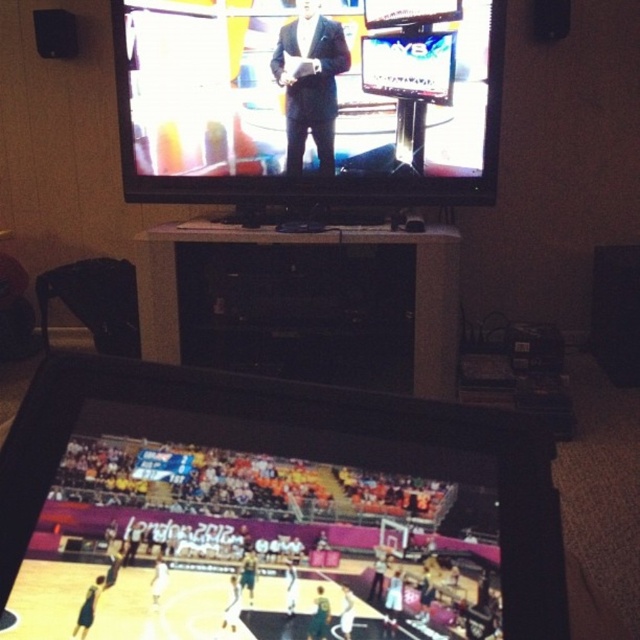
Question: Can you confirm if black glossy tv at upper center is smaller than matte black suit at center?

Choices:
 (A) no
 (B) yes

Answer: (A)

Question: Among these objects, which one is farthest from the camera?

Choices:
 (A) black glossy tv at upper center
 (B) black glossy entertainment center at center
 (C) matte black suit at center

Answer: (C)

Question: Is black glossy tablet at lower center smaller than matte black suit at center?

Choices:
 (A) no
 (B) yes

Answer: (B)

Question: Which of the following is the closest to the observer?

Choices:
 (A) black glossy entertainment center at center
 (B) matte black suit at center
 (C) black glossy tablet at lower center

Answer: (C)

Question: Is black glossy tv at upper center above matte black suit at center?

Choices:
 (A) no
 (B) yes

Answer: (A)

Question: Among these points, which one is nearest to the camera?

Choices:
 (A) (102, 392)
 (B) (333, 257)

Answer: (A)